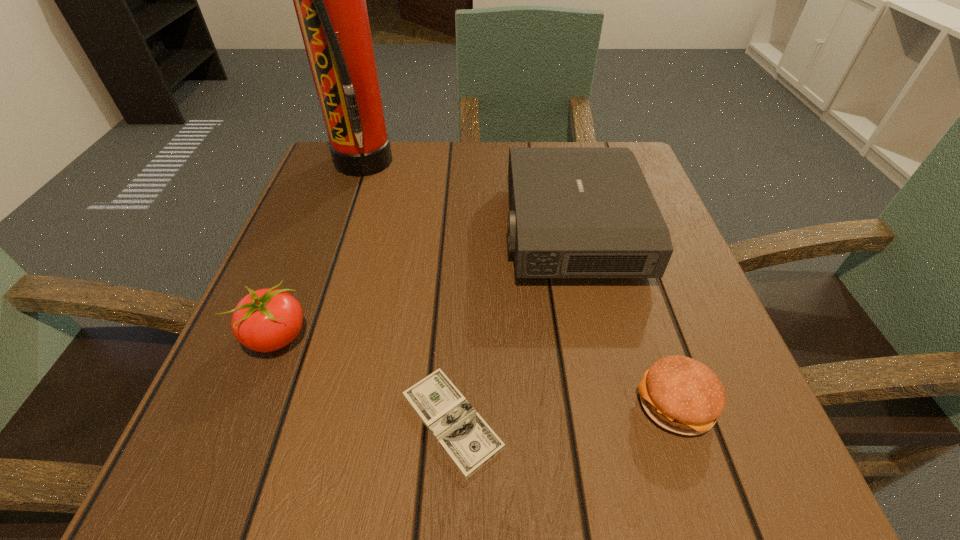
Find the location of a particular element. The width and height of the screenshot is (960, 540). free space between the tomato and the shortest object is located at coordinates (365, 380).

Where is `free space between the second shortest object and the tallest object`? The height and width of the screenshot is (540, 960). free space between the second shortest object and the tallest object is located at coordinates (518, 282).

At what (x,y) coordinates should I click in order to perform the action: click on empty space that is in between the hamburger and the shortest object. Please return your answer as a coordinate pair (x, y). Looking at the image, I should click on (564, 412).

The image size is (960, 540). In order to click on vacant space that's between the third nearest object and the fire extinguisher in this screenshot , I will do `click(320, 250)`.

At what (x,y) coordinates should I click in order to perform the action: click on free point between the third farthest object and the third object from right to left. Please return your answer as a coordinate pair (x, y). The width and height of the screenshot is (960, 540). Looking at the image, I should click on (365, 380).

Find the location of `vacant point located between the fire extinguisher and the fourth tallest object`. vacant point located between the fire extinguisher and the fourth tallest object is located at coordinates click(x=518, y=282).

At what (x,y) coordinates should I click in order to perform the action: click on free space between the fire extinguisher and the dollar. Please return your answer as a coordinate pair (x, y). The image size is (960, 540). Looking at the image, I should click on (407, 292).

This screenshot has width=960, height=540. Identify the location of vacant space that is in between the third farthest object and the dollar. (365, 380).

Where is `unoccupied area between the tallest object and the third object from left to right`? unoccupied area between the tallest object and the third object from left to right is located at coordinates (407, 292).

Locate an element on the screen. Image resolution: width=960 pixels, height=540 pixels. free spot between the third farthest object and the shortest object is located at coordinates (365, 380).